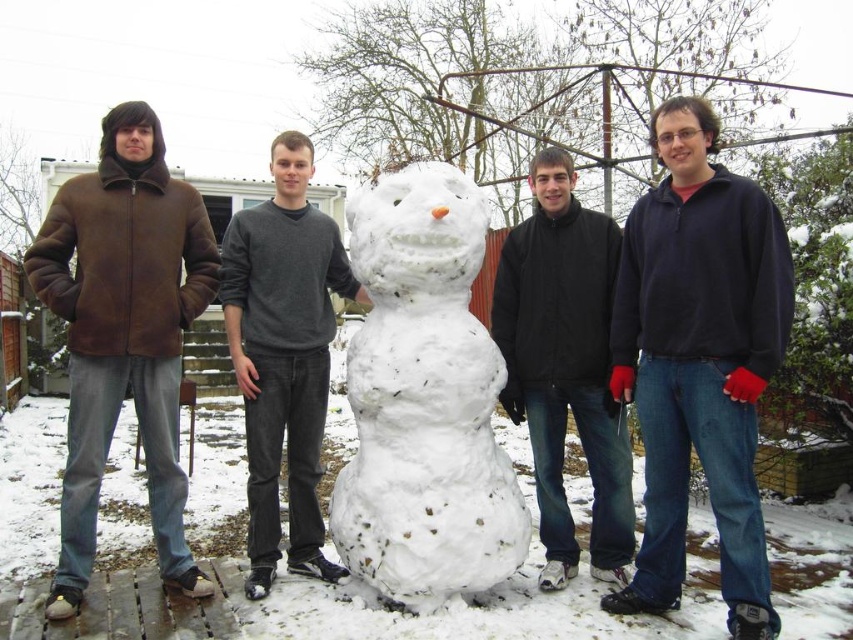
Question: From the image, what is the correct spatial relationship of brown suede jacket at left in relation to dark gray sweater at center?

Choices:
 (A) below
 (B) above

Answer: (B)

Question: Considering the real-world distances, which object is closest to the dark blue fleece at right?

Choices:
 (A) dark gray sweater at center
 (B) brown suede jacket at left
 (C) black matte jacket at center
 (D) white fluffy snowman at center

Answer: (C)

Question: Among these objects, which one is farthest from the camera?

Choices:
 (A) dark blue fleece at right
 (B) dark gray sweater at center
 (C) white fluffy snowman at center

Answer: (B)

Question: Can you confirm if brown suede jacket at left is smaller than dark gray sweater at center?

Choices:
 (A) no
 (B) yes

Answer: (A)

Question: Which object is closer to the camera taking this photo?

Choices:
 (A) brown suede jacket at left
 (B) dark blue fleece at right
 (C) black matte jacket at center

Answer: (B)

Question: Does dark blue fleece at right come in front of white fluffy snowman at center?

Choices:
 (A) yes
 (B) no

Answer: (A)